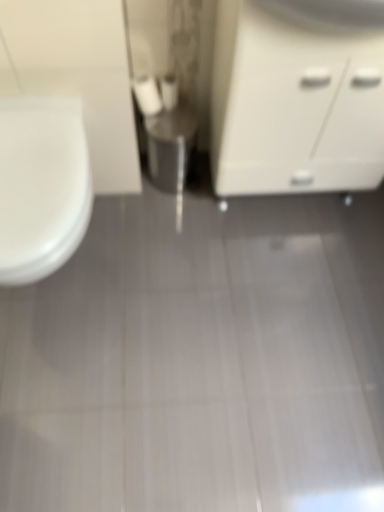
What do you see at coordinates (147, 95) in the screenshot? I see `white matte toilet paper at center, which is the second toilet paper in right-to-left order` at bounding box center [147, 95].

The width and height of the screenshot is (384, 512). In order to click on white matte cabinet at right in this screenshot , I will do `click(297, 96)`.

Does white matte cabinet at right lie in front of white glossy toilet at left?

Yes, the depth of white matte cabinet at right is less than that of white glossy toilet at left.

Between white matte cabinet at right and white glossy toilet at left, which one has more height?

Standing taller between the two is white matte cabinet at right.

From a real-world perspective, is white matte cabinet at right below white glossy toilet at left?

Incorrect, from a real-world perspective, white matte cabinet at right is higher than white glossy toilet at left.

From a real-world perspective, which object stands above the other?

white matte toilet paper at center, which is the second toilet paper in right-to-left order, is physically above.

Considering the sizes of white matte toilet paper at center, which is the second toilet paper in right-to-left order, and white matte toilet paper at center, the 2th toilet paper in the left-to-right sequence, in the image, is white matte toilet paper at center, which is the second toilet paper in right-to-left order, wider or thinner than white matte toilet paper at center, the 2th toilet paper in the left-to-right sequence,?

Clearly, white matte toilet paper at center, which is the second toilet paper in right-to-left order, has more width compared to white matte toilet paper at center, the 2th toilet paper in the left-to-right sequence.

The height and width of the screenshot is (512, 384). Identify the location of toilet paper on the right of white matte toilet paper at center, which is the second toilet paper in right-to-left order. (169, 91).

Is white matte toilet paper at center, which is the second toilet paper in right-to-left order, taller or shorter than white matte toilet paper at center, the 2th toilet paper in the left-to-right sequence?

white matte toilet paper at center, which is the second toilet paper in right-to-left order, is taller than white matte toilet paper at center, the 2th toilet paper in the left-to-right sequence.

In terms of size, does white glossy toilet at left appear bigger or smaller than white matte cabinet at right?

Clearly, white glossy toilet at left is smaller in size than white matte cabinet at right.

From the image's perspective, does white glossy toilet at left appear higher than white matte cabinet at right?

No, from the image's perspective, white glossy toilet at left is not above white matte cabinet at right.

Which object is further away from the camera, white glossy toilet at left or white matte cabinet at right?

white glossy toilet at left is further from the camera.

Is white matte toilet paper at center, placed as the 1th toilet paper when sorted from right to left, outside of white glossy toilet at left?

white matte toilet paper at center, placed as the 1th toilet paper when sorted from right to left, is positioned outside white glossy toilet at left.

Visually, is white matte toilet paper at center, the 2th toilet paper in the left-to-right sequence, positioned to the left or to the right of white glossy toilet at left?

Clearly, white matte toilet paper at center, the 2th toilet paper in the left-to-right sequence, is on the right of white glossy toilet at left in the image.

Can you tell me how much white matte toilet paper at center, placed as the 1th toilet paper when sorted from right to left, and white glossy toilet at left differ in facing direction?

The angular difference between white matte toilet paper at center, placed as the 1th toilet paper when sorted from right to left, and white glossy toilet at left is 0.354 degrees.

At what (x,y) coordinates should I click in order to perform the action: click on toilet below the white matte toilet paper at center, the 2th toilet paper in the left-to-right sequence (from the image's perspective). Please return your answer as a coordinate pair (x, y). The height and width of the screenshot is (512, 384). Looking at the image, I should click on (42, 186).

Considering the sizes of objects white glossy toilet at left and white matte toilet paper at center, the 2th toilet paper in the left-to-right sequence, in the image provided, who is smaller, white glossy toilet at left or white matte toilet paper at center, the 2th toilet paper in the left-to-right sequence,?

white matte toilet paper at center, the 2th toilet paper in the left-to-right sequence.

Which object is further away from the camera, white glossy toilet at left or white matte toilet paper at center, placed as the 1th toilet paper when sorted from right to left?

white matte toilet paper at center, placed as the 1th toilet paper when sorted from right to left, is further away from the camera.

Based on the photo, is white glossy toilet at left inside or outside of white matte toilet paper at center, the 2th toilet paper in the left-to-right sequence?

The correct answer is: outside.

Can you tell me how much white glossy toilet at left and white matte toilet paper at center, the 2th toilet paper in the left-to-right sequence, differ in facing direction?

0.354 degrees.

From the image's perspective, does white matte toilet paper at center, placed as the 1th toilet paper when sorted from right to left, appear higher than white matte cabinet at right?

Yes, from the image's perspective, white matte toilet paper at center, placed as the 1th toilet paper when sorted from right to left, is on top of white matte cabinet at right.

Can you confirm if white matte toilet paper at center, placed as the 1th toilet paper when sorted from right to left, is smaller than white matte cabinet at right?

Indeed, white matte toilet paper at center, placed as the 1th toilet paper when sorted from right to left, has a smaller size compared to white matte cabinet at right.

Does white matte toilet paper at center, placed as the 1th toilet paper when sorted from right to left, appear on the left side of white matte cabinet at right?

Indeed, white matte toilet paper at center, placed as the 1th toilet paper when sorted from right to left, is positioned on the left side of white matte cabinet at right.

From a real-world perspective, is white matte toilet paper at center, the 2th toilet paper in the left-to-right sequence, physically located above or below white matte cabinet at right?

In terms of real-world spatial position, white matte toilet paper at center, the 2th toilet paper in the left-to-right sequence, is below white matte cabinet at right.

Who is bigger, white matte toilet paper at center, which is the second toilet paper in right-to-left order, or white matte cabinet at right?

white matte cabinet at right.

Could you tell me if white matte toilet paper at center, the first toilet paper viewed from the left, is facing white matte cabinet at right?

No, white matte toilet paper at center, the first toilet paper viewed from the left, is not facing towards white matte cabinet at right.

Choose the correct answer: Is white matte toilet paper at center, which is the second toilet paper in right-to-left order, inside white matte cabinet at right or outside it?

white matte toilet paper at center, which is the second toilet paper in right-to-left order, is not enclosed by white matte cabinet at right.

Is white matte toilet paper at center, which is the second toilet paper in right-to-left order, positioned in front of white matte cabinet at right?

No, the depth of white matte toilet paper at center, which is the second toilet paper in right-to-left order, is greater than that of white matte cabinet at right.

Locate an element on the screen. bathroom cabinet that is on the right side of white glossy toilet at left is located at coordinates (297, 96).

In the image, there is a white matte toilet paper at center, the first toilet paper viewed from the left. Identify the location of toilet paper above it (from the image's perspective). This screenshot has height=512, width=384. (169, 91).

From the image, which object appears to be farther from white matte cabinet at right, white glossy toilet at left or white matte toilet paper at center, the 2th toilet paper in the left-to-right sequence?

Among the two, white glossy toilet at left is located further to white matte cabinet at right.

When comparing their distances from white glossy toilet at left, does white matte cabinet at right or white matte toilet paper at center, the 2th toilet paper in the left-to-right sequence, seem further?

white matte cabinet at right.

Estimate the real-world distances between objects in this image. Which object is further from white matte cabinet at right, white matte toilet paper at center, the 2th toilet paper in the left-to-right sequence, or white matte toilet paper at center, which is the second toilet paper in right-to-left order?

Among the two, white matte toilet paper at center, which is the second toilet paper in right-to-left order, is located further to white matte cabinet at right.

Which object lies further to the anchor point white matte cabinet at right, white matte toilet paper at center, the 2th toilet paper in the left-to-right sequence, or white glossy toilet at left?

Based on the image, white glossy toilet at left appears to be further to white matte cabinet at right.

Based on their spatial positions, is white glossy toilet at left or white matte cabinet at right closer to white matte toilet paper at center, which is the second toilet paper in right-to-left order?

Among the two, white matte cabinet at right is located nearer to white matte toilet paper at center, which is the second toilet paper in right-to-left order.

Looking at the image, which one is located closer to white matte toilet paper at center, the 2th toilet paper in the left-to-right sequence, white matte toilet paper at center, the first toilet paper viewed from the left, or white glossy toilet at left?

white matte toilet paper at center, the first toilet paper viewed from the left.

Considering their positions, is white matte toilet paper at center, the first toilet paper viewed from the left, positioned further to white matte cabinet at right than white matte toilet paper at center, the 2th toilet paper in the left-to-right sequence?

Among the two, white matte toilet paper at center, the first toilet paper viewed from the left, is located further to white matte cabinet at right.

Based on their spatial positions, is white glossy toilet at left or white matte toilet paper at center, which is the second toilet paper in right-to-left order, further from white matte toilet paper at center, placed as the 1th toilet paper when sorted from right to left?

white glossy toilet at left is further to white matte toilet paper at center, placed as the 1th toilet paper when sorted from right to left.

Where is `toilet paper between white matte cabinet at right and white matte toilet paper at center, the 2th toilet paper in the left-to-right sequence, in the front-back direction`? Image resolution: width=384 pixels, height=512 pixels. toilet paper between white matte cabinet at right and white matte toilet paper at center, the 2th toilet paper in the left-to-right sequence, in the front-back direction is located at coordinates (147, 95).

This screenshot has height=512, width=384. In order to click on toilet paper positioned between white glossy toilet at left and white matte toilet paper at center, placed as the 1th toilet paper when sorted from right to left, from near to far in this screenshot , I will do `click(147, 95)`.